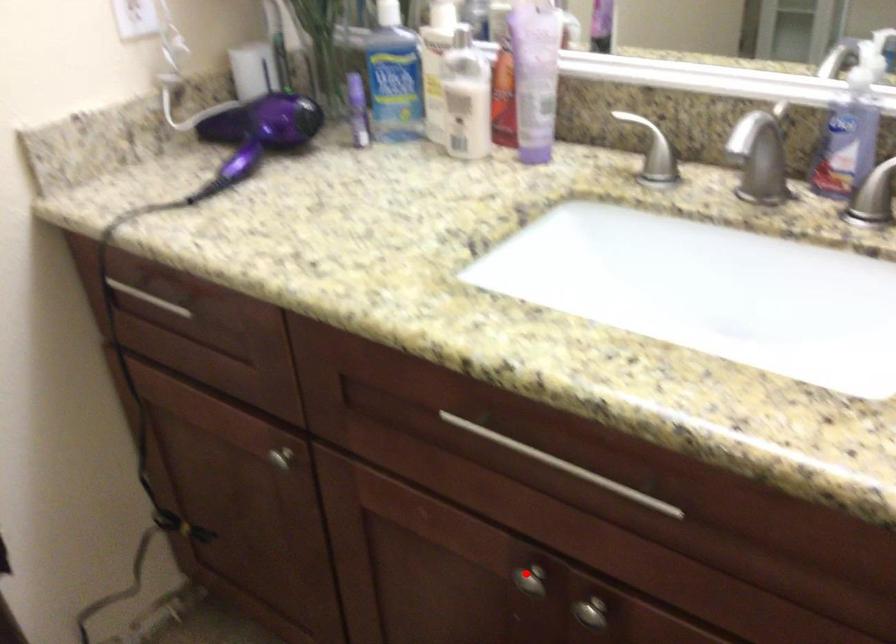
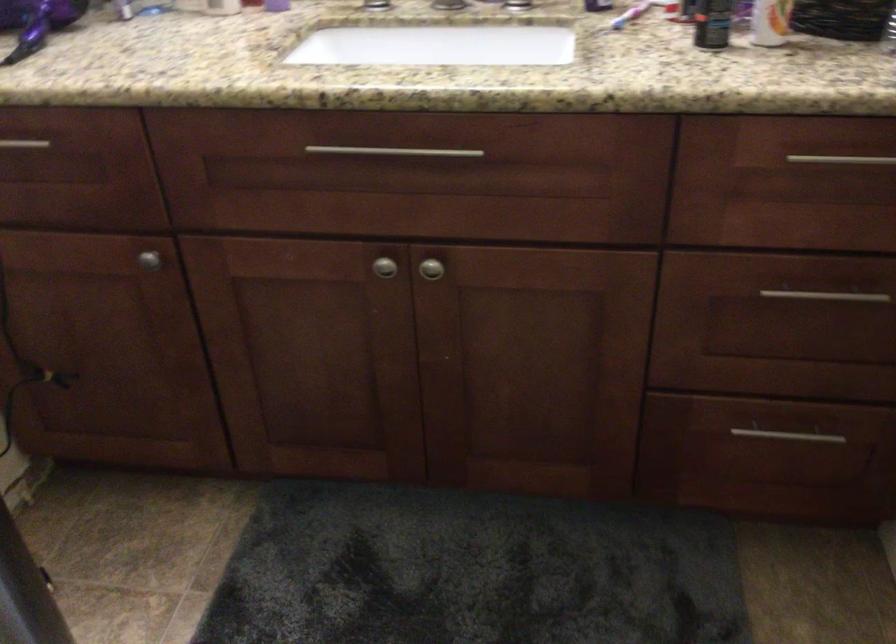
Locate, in the second image, the point that corresponds to the highlighted location in the first image.

(383, 267)